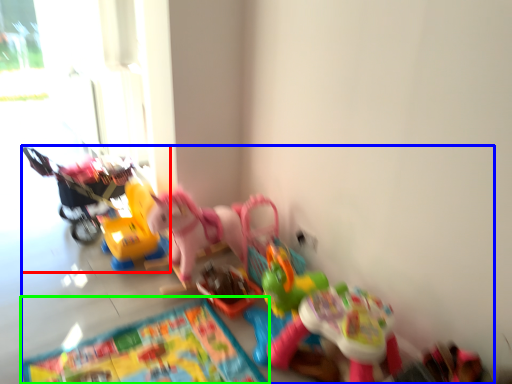
Question: Considering the real-world distances, which object is closest to toy (highlighted by a red box)? toy (highlighted by a blue box) or mat (highlighted by a green box).

Choices:
 (A) toy
 (B) mat

Answer: (A)